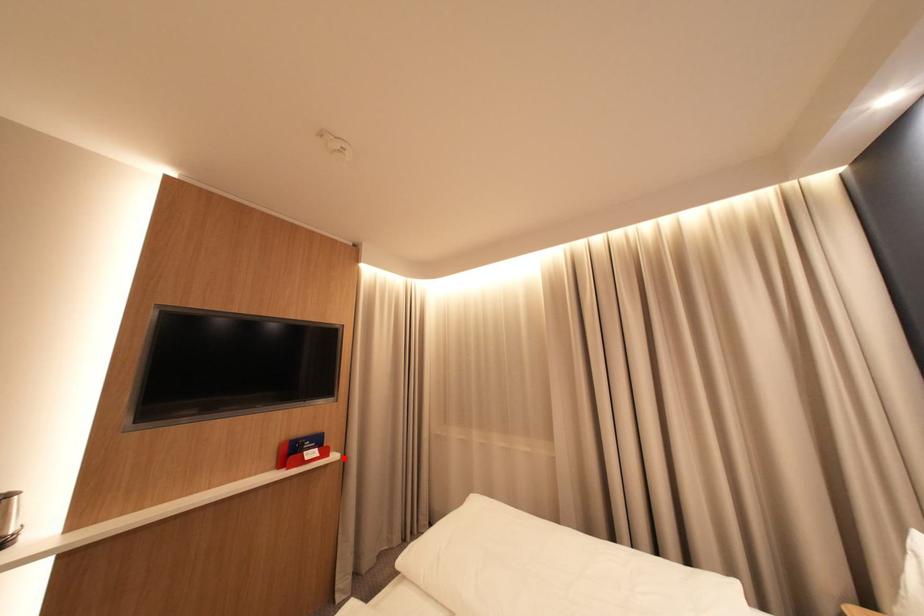
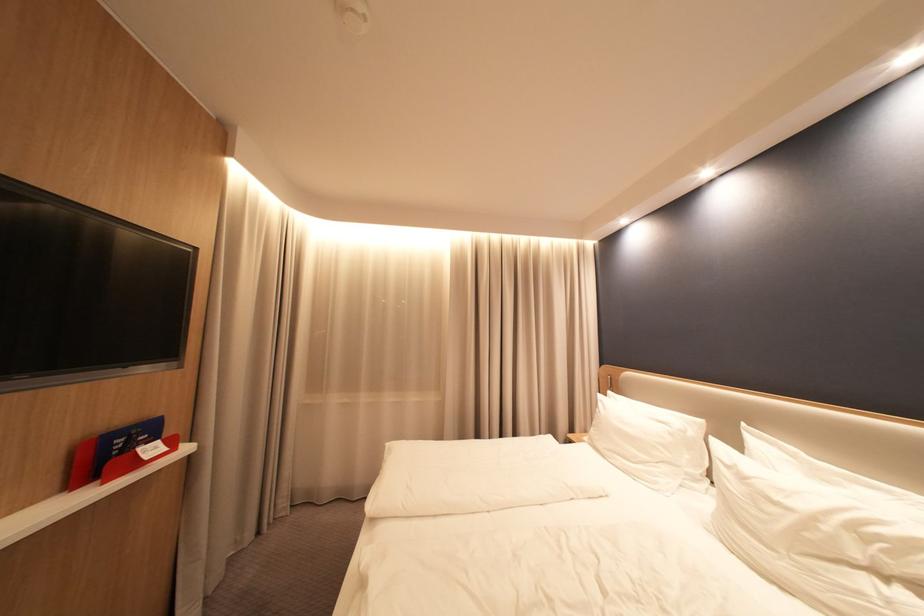
Where in the second image is the point corresponding to the highlighted location from the first image?

(197, 450)